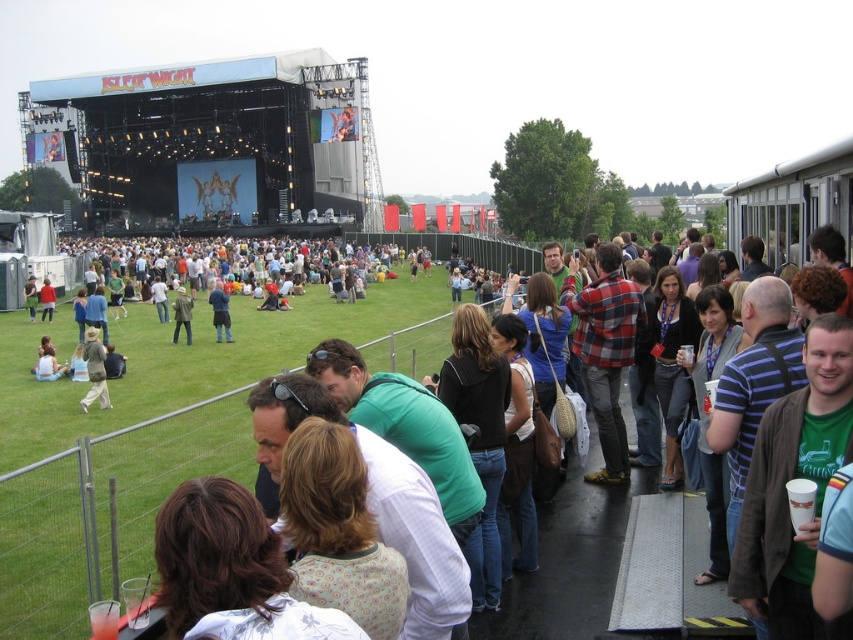
You are a photographer at the Isle of Wight festival. You want to capture a photo of the stage and the crowd. You are currently standing at the point marked by point (103, 512). Which direction should you move to get a better view of the stage?

Since point (103, 512) marks green grass at center, you should move forward towards the stage to get a better view of it.

Based on the photo, you are standing at the center of the stage at the Isle of Wight festival. You notice a person wearing khaki cotton pants at lower left. In which direction relative to your position is this person located?

The khaki cotton pants at lower left is located at point 0.580 on the x axis and 0.113 on the y axis, which places them to the lower left relative to your position on stage.